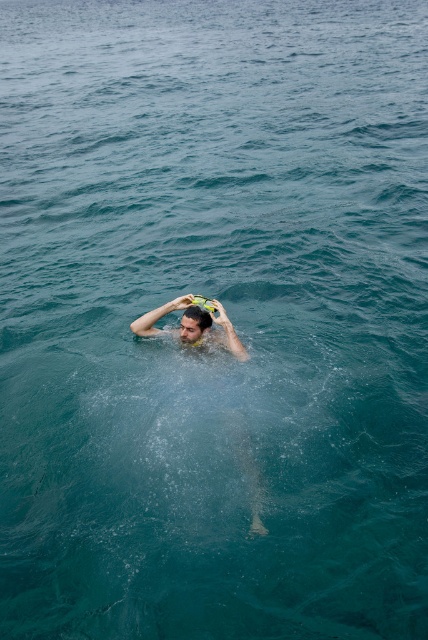
Who is more distant from viewer, (x=219, y=344) or (x=183, y=332)?

Point (x=219, y=344)

Which is below, smooth skin man at center or yellow-green rubber snorkel at center?

Positioned lower is yellow-green rubber snorkel at center.

Is point (136, 320) farther from viewer compared to point (231, 349)?

That is True.

Where is `smooth skin man at center`? smooth skin man at center is located at coordinates (178, 326).

Which is behind, point (222, 330) or point (202, 336)?

The point (222, 330) is behind.

Is point (186, 317) positioned in front of point (198, 310)?

No, it is not.

Locate an element on the screen. This screenshot has height=640, width=428. yellow-green rubber snorkel at center is located at coordinates (193, 324).

The width and height of the screenshot is (428, 640). I want to click on yellow-green rubber snorkel at center, so click(193, 324).

Can you confirm if smooth skin man at center is positioned below matte black hair at upper center?

No, smooth skin man at center is not below matte black hair at upper center.

Who is positioned more to the right, smooth skin man at center or matte black hair at upper center?

Positioned to the right is smooth skin man at center.

The width and height of the screenshot is (428, 640). What do you see at coordinates (178, 326) in the screenshot?
I see `smooth skin man at center` at bounding box center [178, 326].

At what (x,y) coordinates should I click in order to perform the action: click on smooth skin man at center. Please return your answer as a coordinate pair (x, y). The height and width of the screenshot is (640, 428). Looking at the image, I should click on (178, 326).